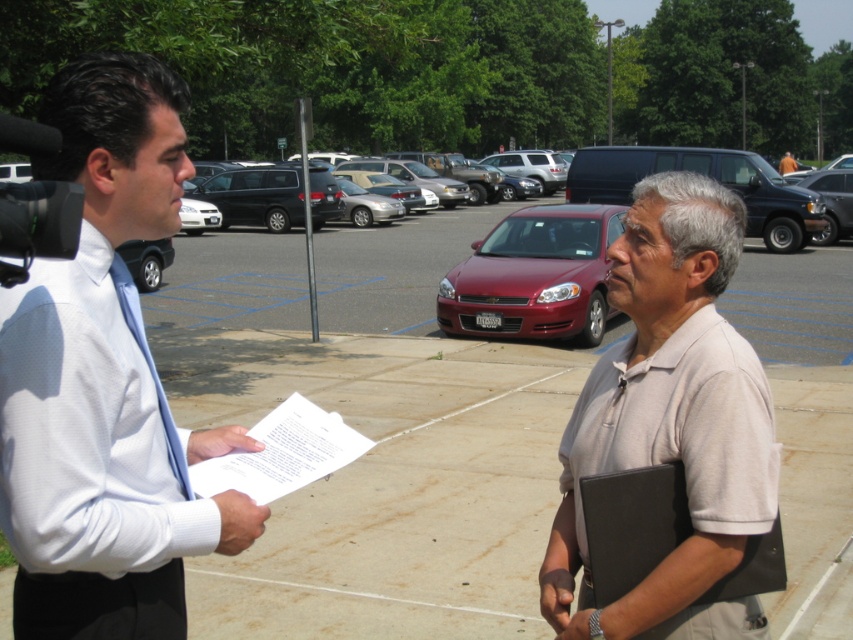
You are a photographer trying to capture a candid shot of the interview scene. You want to ensure that both the shiny red sedan at center and the orange fabric shirt at center are visible in the frame. Given their sizes, which object should you prioritize framing closer to the camera to ensure both are visible without cropping?

The shiny red sedan at center occupies less space than orange fabric shirt at center, so you should prioritize framing the orange fabric shirt at center closer to the camera. This way, the larger orange fabric shirt at center will take up more of the frame, while the smaller shiny red sedan at center can still be captured in the background without cropping.

You are a delivery driver who needs to park your vehicle in a narrow space between the matte black minivan at center and the orange fabric shirt at center. The space is only 1.8 meters wide. Can your truck, which is 2.0 meters wide, fit into this space?

The matte black minivan at center might be wider than orange fabric shirt at center, so the total width between them may exceed 1.8 meters. Your truck is 2.0 meters wide, which is wider than the available space. Therefore, it is unlikely to fit.

You are a photographer trying to capture a clear photo of the shiny red sedan at center and the blue textured tie at left. Which object should you focus on first if you want to ensure both are in focus without adjusting the camera settings?

The shiny red sedan at center is taller than the blue textured tie at left, so you should focus on the shiny red sedan at center first since it is larger and requires more precise focus to ensure both are in focus.